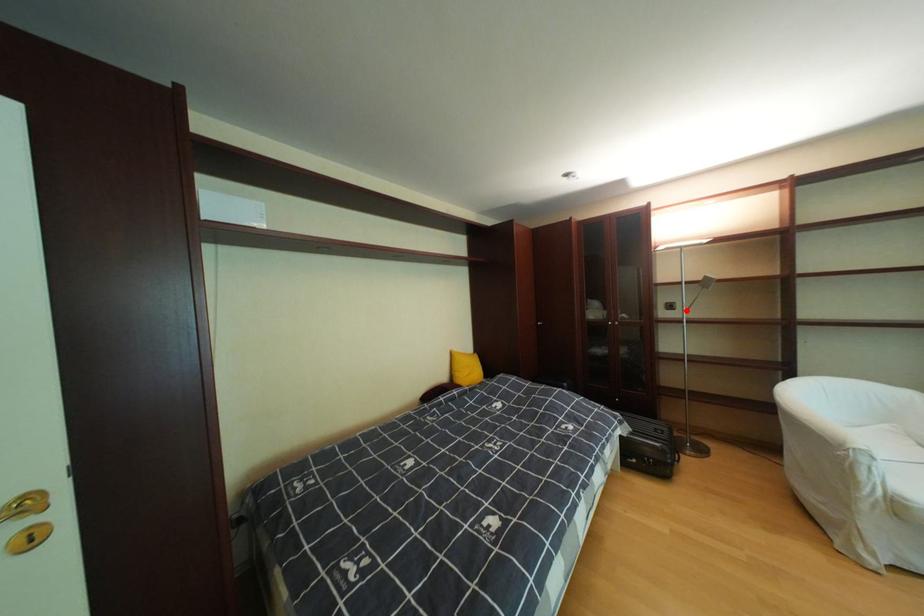
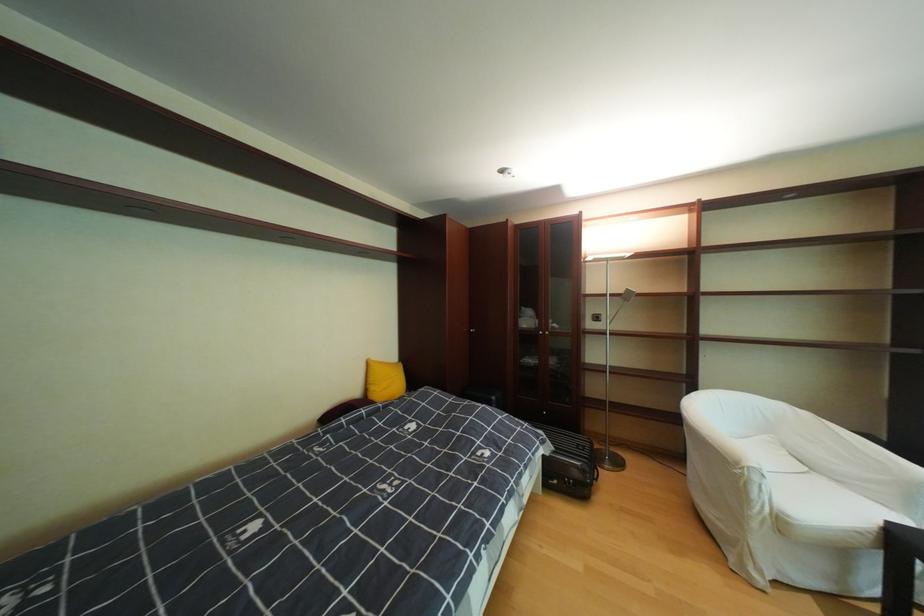
Locate, in the second image, the point that corresponds to the highlighted location in the first image.

(612, 322)